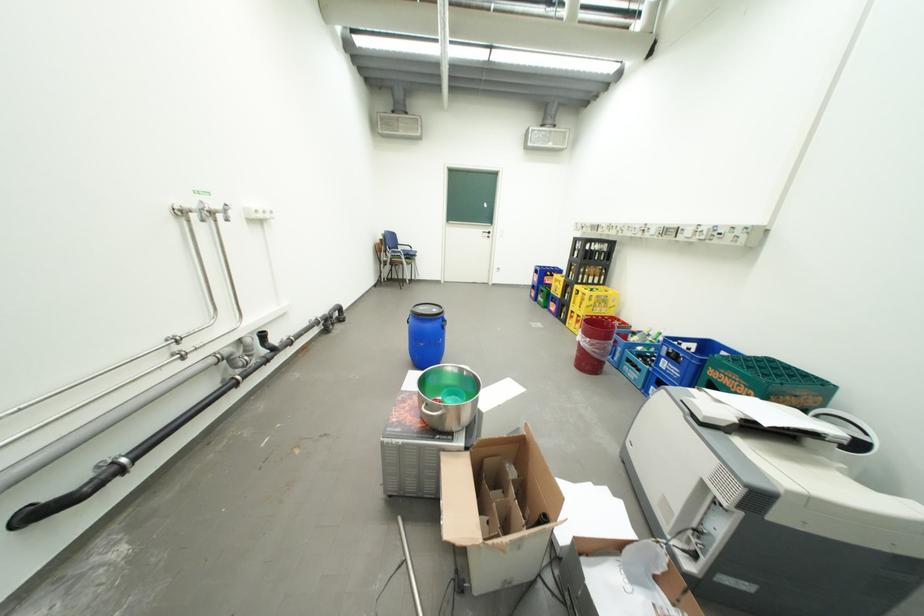
Which object does [766,381] point to?

This point indicates the green bottle crate.